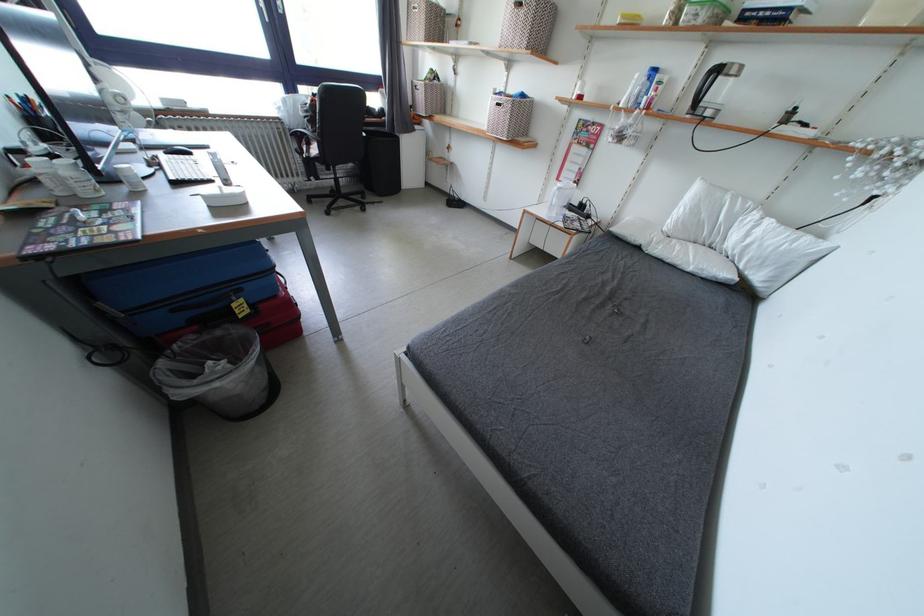
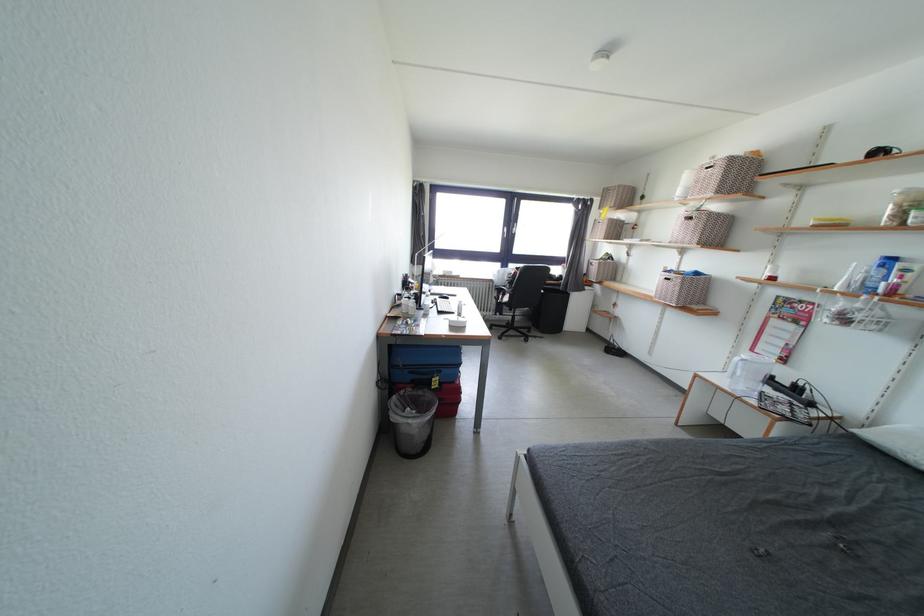
Locate, in the second image, the point that corresponds to (x=247, y=294) in the first image.

(446, 377)